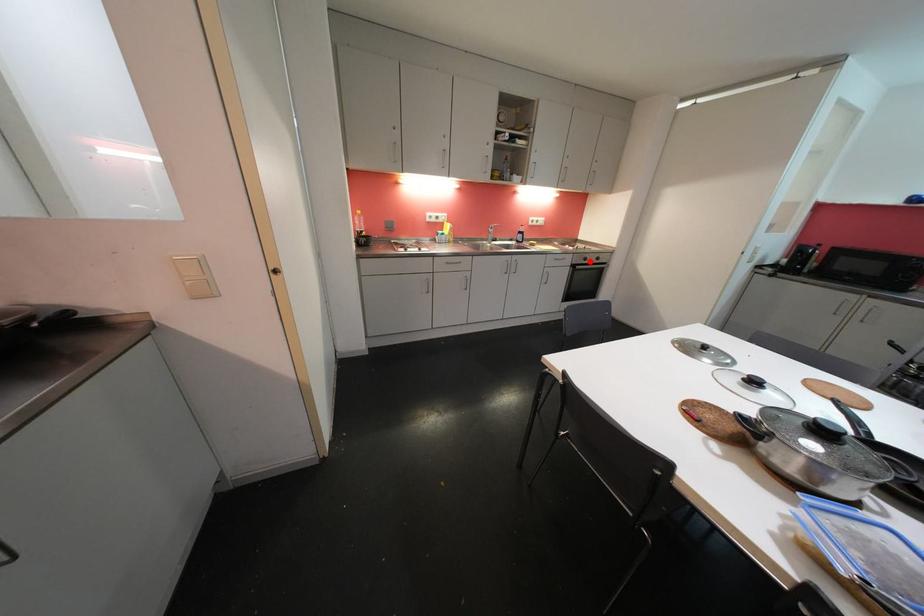
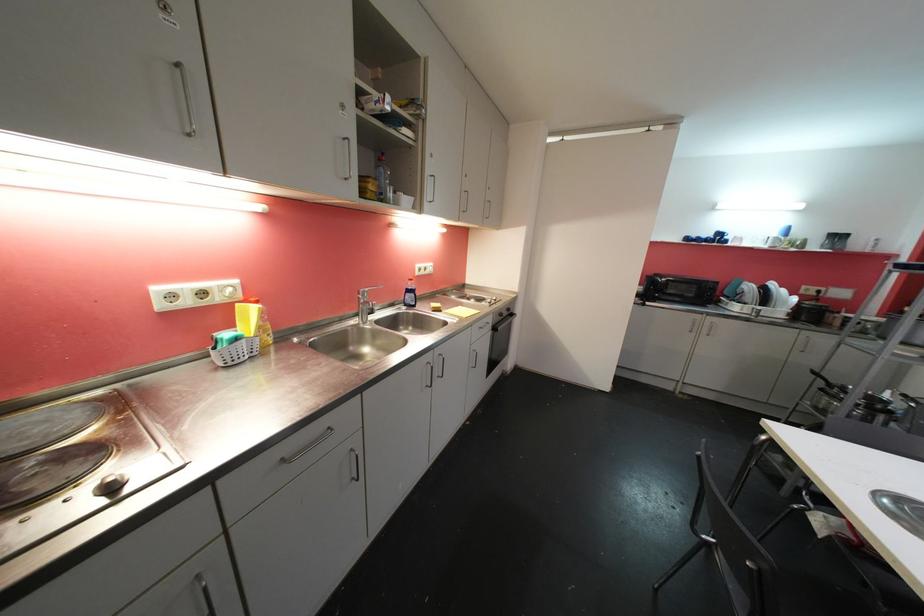
Question: I am providing you with two images of the same scene from different viewpoints. In image1, a red point is highlighted. Considering the same 3D point in image2, which of the following is correct?

Choices:
 (A) It is closer
 (B) It is farther

Answer: (B)